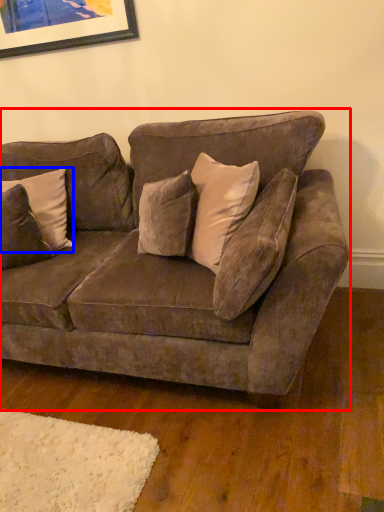
Question: Which of the following is the closest to the observer, studio couch (highlighted by a red box) or pillow (highlighted by a blue box)?

Choices:
 (A) studio couch
 (B) pillow

Answer: (A)